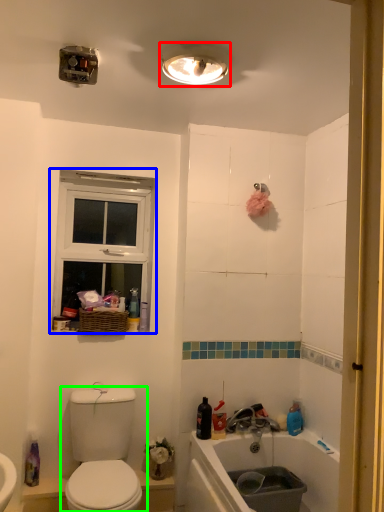
Question: Based on their relative distances, which object is nearer to light fixture (highlighted by a red box)? Choose from window (highlighted by a blue box) and toilet (highlighted by a green box).

Choices:
 (A) window
 (B) toilet

Answer: (A)